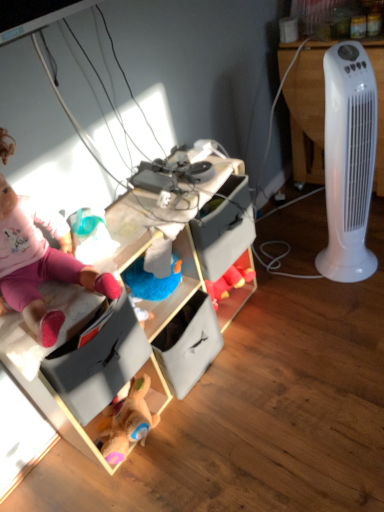
This screenshot has width=384, height=512. I want to click on vacant area that lies between white plastic tower fan at right and wooden toy storage at center, so tap(276, 324).